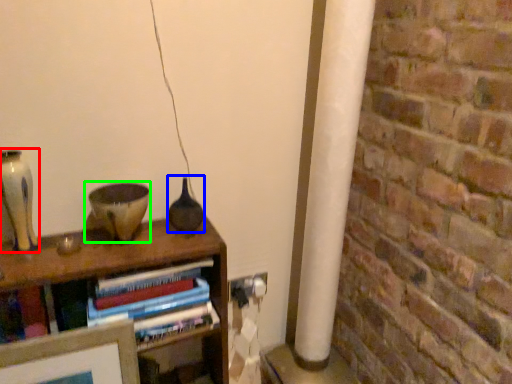
Question: Considering the real-world distances, which object is farthest from glass vase (highlighted by a red box)? glass vase (highlighted by a blue box) or candle holder (highlighted by a green box)?

Choices:
 (A) glass vase
 (B) candle holder

Answer: (A)